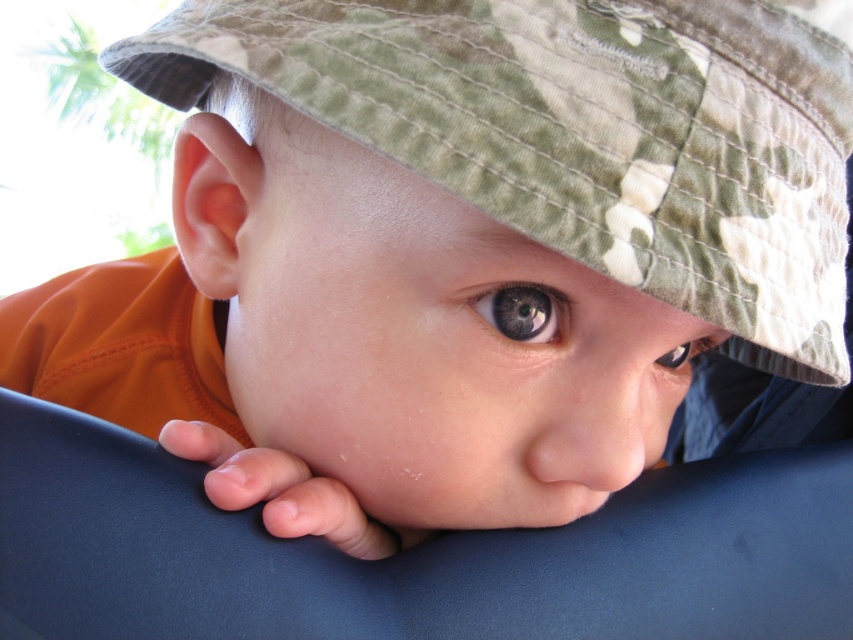
You are a photographer adjusting your camera to focus on two points in the image. The first point is at coordinates point (529, 337), and the second is at point (682, 344). Which point should you focus on first if you want to capture the closest object to the camera?

Point (529, 337) is closer to the camera than point (682, 344), so you should focus on point (529, 337) first to capture the closest object.

Based on the scene description, where exactly is the green matte eye at center located?

The green matte eye at center is located at point (x=521, y=312).

Looking at this image, you are an optometrist examining the eyes of a child in the image. You notice two eyes labeled as the green matte eye at center and brown matte eye at center. Which eye has a smaller vertical dimension?

The green matte eye at center has a lesser height compared to the brown matte eye at center, so the green matte eye at center has a smaller vertical dimension.